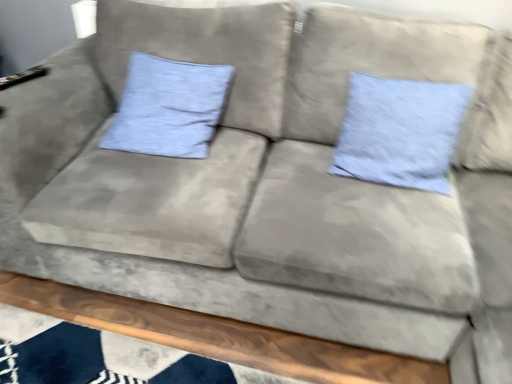
Question: From the image's perspective, would you say light blue fabric pillow at center, the second pillow when ordered from left to right, is positioned over light blue fabric pillow at upper left, placed as the 1th pillow when sorted from left to right?

Choices:
 (A) yes
 (B) no

Answer: (B)

Question: From a real-world perspective, is light blue fabric pillow at center, which ranks as the 1th pillow in right-to-left order, positioned over light blue fabric pillow at upper left, the 2th pillow when ordered from right to left, based on gravity?

Choices:
 (A) yes
 (B) no

Answer: (A)

Question: Is light blue fabric pillow at center, the second pillow when ordered from left to right, further to the viewer compared to light blue fabric pillow at upper left, the 2th pillow when ordered from right to left?

Choices:
 (A) no
 (B) yes

Answer: (A)

Question: From a real-world perspective, does light blue fabric pillow at center, the second pillow when ordered from left to right, sit lower than light blue fabric pillow at upper left, placed as the 1th pillow when sorted from left to right?

Choices:
 (A) no
 (B) yes

Answer: (A)

Question: Does light blue fabric pillow at center, which ranks as the 1th pillow in right-to-left order, appear on the left side of light blue fabric pillow at upper left, placed as the 1th pillow when sorted from left to right?

Choices:
 (A) yes
 (B) no

Answer: (B)

Question: Is light blue fabric pillow at center, the second pillow when ordered from left to right, closer to the viewer compared to light blue fabric pillow at upper left, the 2th pillow when ordered from right to left?

Choices:
 (A) no
 (B) yes

Answer: (B)

Question: Is light blue fabric pillow at upper left, the 2th pillow when ordered from right to left, not close to light blue fabric pillow at center, the second pillow when ordered from left to right?

Choices:
 (A) yes
 (B) no

Answer: (B)

Question: Is light blue fabric pillow at upper left, the 2th pillow when ordered from right to left, with light blue fabric pillow at center, which ranks as the 1th pillow in right-to-left order?

Choices:
 (A) no
 (B) yes

Answer: (A)

Question: Considering the relative sizes of light blue fabric pillow at upper left, the 2th pillow when ordered from right to left, and light blue fabric pillow at center, which ranks as the 1th pillow in right-to-left order, in the image provided, is light blue fabric pillow at upper left, the 2th pillow when ordered from right to left, taller than light blue fabric pillow at center, which ranks as the 1th pillow in right-to-left order,?

Choices:
 (A) yes
 (B) no

Answer: (B)

Question: Is light blue fabric pillow at upper left, the 2th pillow when ordered from right to left, smaller than light blue fabric pillow at center, the second pillow when ordered from left to right?

Choices:
 (A) yes
 (B) no

Answer: (B)

Question: Considering the relative sizes of light blue fabric pillow at upper left, the 2th pillow when ordered from right to left, and light blue fabric pillow at center, the second pillow when ordered from left to right, in the image provided, is light blue fabric pillow at upper left, the 2th pillow when ordered from right to left, thinner than light blue fabric pillow at center, the second pillow when ordered from left to right,?

Choices:
 (A) no
 (B) yes

Answer: (A)

Question: Is light blue fabric pillow at upper left, placed as the 1th pillow when sorted from left to right, turned away from light blue fabric pillow at center, the second pillow when ordered from left to right?

Choices:
 (A) no
 (B) yes

Answer: (A)

Question: Considering the positions of light blue fabric pillow at upper left, placed as the 1th pillow when sorted from left to right, and light blue fabric pillow at center, which ranks as the 1th pillow in right-to-left order, in the image, is light blue fabric pillow at upper left, placed as the 1th pillow when sorted from left to right, wider or thinner than light blue fabric pillow at center, which ranks as the 1th pillow in right-to-left order,?

Choices:
 (A) thin
 (B) wide

Answer: (B)